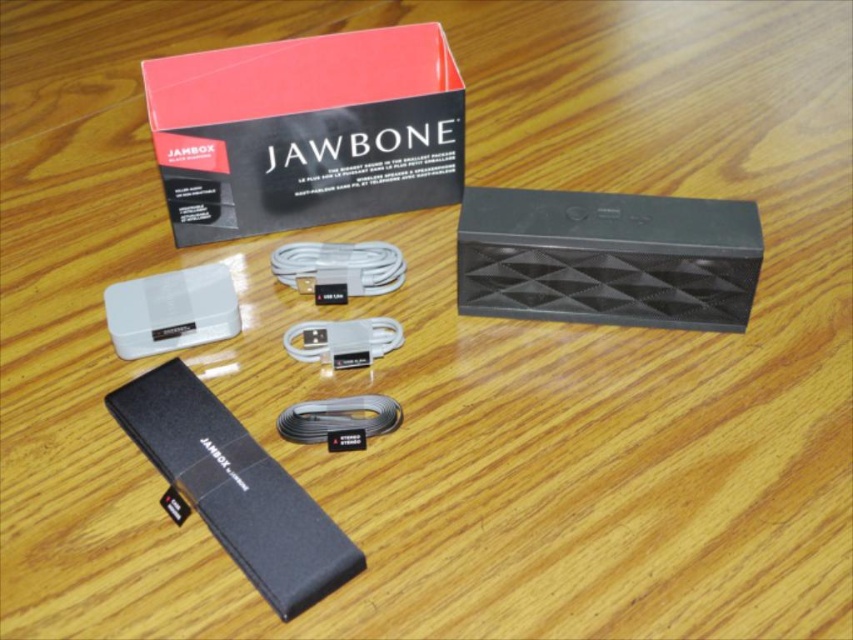
You are setting up the Jawbone Jambox speaker and need to connect it to a power source. The matte black box at upper center is the speaker, and the white matte cable at center is the charging cable. How far apart are these two items on the wooden surface?

The matte black box at upper center and white matte cable at center are 23.31 centimeters apart.

You are setting up the Jawbone Jambox speaker and need to connect the power source. You have a black matte battery at lower left and a satin silver cable at center. Which one should you use to power the speaker?

The black matte battery at lower left should be used to power the speaker since it is larger in size compared to the satin silver cable at center, indicating it might be the appropriate power source.

You are setting up a speaker system and need to connect the black matte battery at lower left to the satin silver cable at center. Can you reach the battery without moving the cable?

The black matte battery at lower left is positioned under the satin silver cable at center, so you can reach it by moving the cable slightly to access the battery located beneath it.